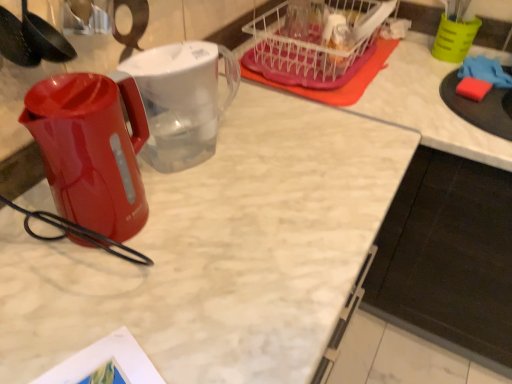
You are a GUI agent. You are given a task and a screenshot of the screen. Output one action in this format:
    pyautogui.click(x=<x>, y=<y>)
    Task: Click on the free space between glossy plastic kettle at left and transparent plastic pitcher at center
    The width and height of the screenshot is (512, 384).
    Given the screenshot: What is the action you would take?
    tap(190, 195)